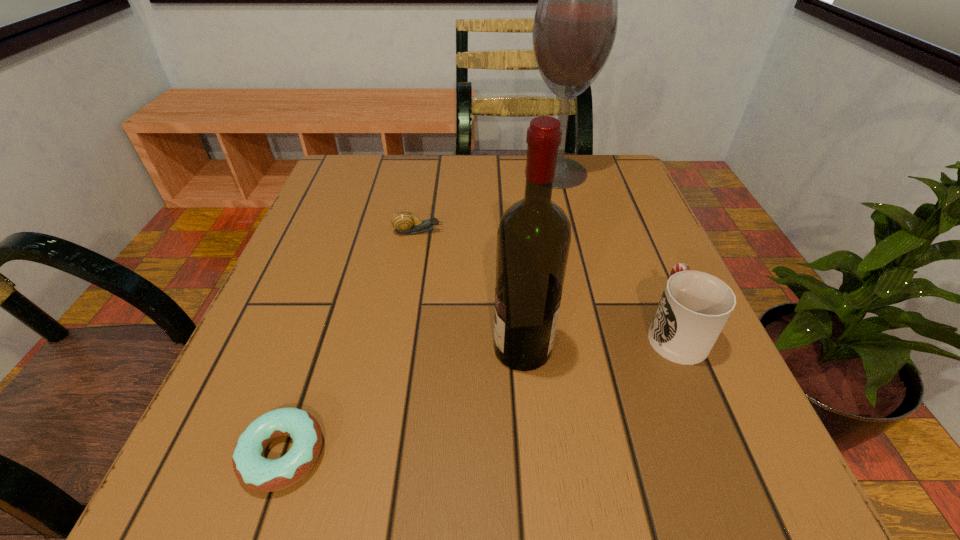
Locate an element on the screen. the farthest object is located at coordinates (575, 24).

I want to click on the nearer alcohol, so click(x=533, y=240).

Where is `cup`? The width and height of the screenshot is (960, 540). cup is located at coordinates (695, 306).

You are a GUI agent. You are given a task and a screenshot of the screen. Output one action in this format:
    pyautogui.click(x=<x>, y=<y>)
    Task: Click on the third tallest object
    The image size is (960, 540).
    Given the screenshot: What is the action you would take?
    pyautogui.click(x=695, y=306)

Locate an element on the screen. Image resolution: width=960 pixels, height=540 pixels. the second farthest object is located at coordinates (404, 222).

This screenshot has height=540, width=960. Find the location of `the second shortest object`. the second shortest object is located at coordinates (404, 222).

What are the coordinates of `the leftmost object` in the screenshot? It's located at (252, 469).

Identify the location of the shortest object. (252, 469).

Locate an element on the screen. This screenshot has width=960, height=540. vacant space located 0.180m on the front of the farther alcohol is located at coordinates (572, 238).

Find the location of `vacant space located 0.310m on the front and back of the nearer alcohol`. vacant space located 0.310m on the front and back of the nearer alcohol is located at coordinates (295, 349).